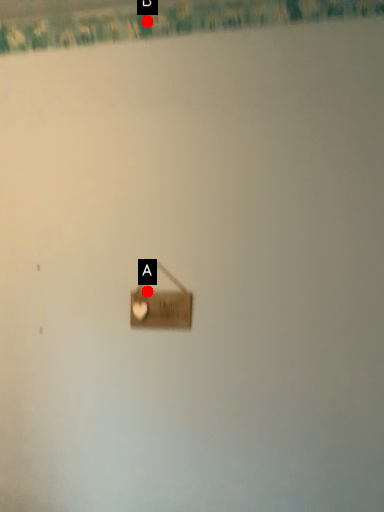
Question: Two points are circled on the image, labeled by A and B beside each circle. Among these points, which one is nearest to the camera?

Choices:
 (A) A is closer
 (B) B is closer

Answer: (A)